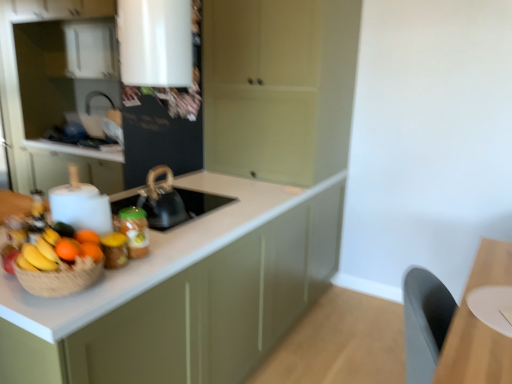
At what (x,y) coordinates should I click in order to perform the action: click on vacant space to the right of translucent glass jar at center. Please return your answer as a coordinate pair (x, y). The image size is (512, 384). Looking at the image, I should click on (168, 254).